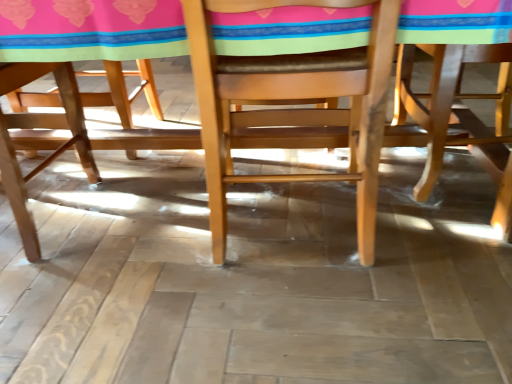
Question: From a real-world perspective, is light brown wood chair at right, marked as the 2th chair in a left-to-right arrangement, positioned under wooden table at center based on gravity?

Choices:
 (A) yes
 (B) no

Answer: (A)

Question: Could you tell me if light brown wood chair at right, marked as the first chair in a right-to-left arrangement, is facing wooden table at center?

Choices:
 (A) no
 (B) yes

Answer: (B)

Question: Is the depth of light brown wood chair at right, marked as the 2th chair in a left-to-right arrangement, less than that of wooden table at center?

Choices:
 (A) yes
 (B) no

Answer: (B)

Question: Would you consider light brown wood chair at right, marked as the 2th chair in a left-to-right arrangement, to be distant from wooden table at center?

Choices:
 (A) no
 (B) yes

Answer: (A)

Question: Considering the relative positions of light brown wood chair at right, marked as the 2th chair in a left-to-right arrangement, and wooden table at center in the image provided, is light brown wood chair at right, marked as the 2th chair in a left-to-right arrangement, to the right of wooden table at center from the viewer's perspective?

Choices:
 (A) yes
 (B) no

Answer: (A)

Question: Is light brown wood chair at right, marked as the first chair in a right-to-left arrangement, inside or outside of wooden table at center?

Choices:
 (A) outside
 (B) inside

Answer: (B)

Question: Is point (410, 67) positioned closer to the camera than point (200, 82)?

Choices:
 (A) farther
 (B) closer

Answer: (A)

Question: Looking at the image, does light brown wood chair at right, marked as the 2th chair in a left-to-right arrangement, seem bigger or smaller compared to wooden table at center?

Choices:
 (A) small
 (B) big

Answer: (A)

Question: From the image's perspective, is light brown wood chair at right, marked as the first chair in a right-to-left arrangement, located above or below wooden table at center?

Choices:
 (A) below
 (B) above

Answer: (A)

Question: Is point (310, 9) positioned closer to the camera than point (217, 231)?

Choices:
 (A) closer
 (B) farther

Answer: (A)

Question: From a real-world perspective, relative to natural wood chair at center, the 1th chair in the left-to-right sequence, is wooden table at center vertically above or below?

Choices:
 (A) above
 (B) below

Answer: (A)

Question: From the image's perspective, is wooden table at center located above or below natural wood chair at center, the 1th chair in the left-to-right sequence?

Choices:
 (A) below
 (B) above

Answer: (B)

Question: Looking at the image, does wooden table at center seem bigger or smaller compared to natural wood chair at center, the 1th chair in the left-to-right sequence?

Choices:
 (A) small
 (B) big

Answer: (B)

Question: Looking at their shapes, would you say light brown wood chair at right, marked as the 2th chair in a left-to-right arrangement, is wider or thinner than natural wood chair at center, the 1th chair in the left-to-right sequence?

Choices:
 (A) thin
 (B) wide

Answer: (A)

Question: In terms of height, does light brown wood chair at right, marked as the 2th chair in a left-to-right arrangement, look taller or shorter compared to natural wood chair at center, the 1th chair in the left-to-right sequence?

Choices:
 (A) short
 (B) tall

Answer: (A)